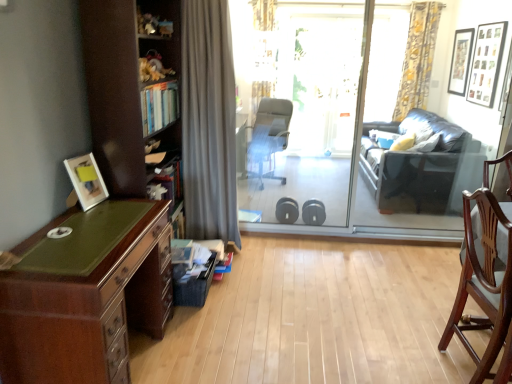
Question: Considering the positions of black matte picture frame at upper right, the 1th picture frame in the top-to-bottom sequence, and gray fabric office chair at center, marked as the first chair in a top-to-bottom arrangement, in the image, is black matte picture frame at upper right, the 1th picture frame in the top-to-bottom sequence, wider or thinner than gray fabric office chair at center, marked as the first chair in a top-to-bottom arrangement,?

Choices:
 (A) thin
 (B) wide

Answer: (A)

Question: Is point (467, 54) closer or farther from the camera than point (268, 107)?

Choices:
 (A) closer
 (B) farther

Answer: (A)

Question: Which object is the closest to the dark blue leather couch at right?

Choices:
 (A) wooden picture frame at upper right, placed as the second picture frame when sorted from back to front
 (B) mahogany wood chair at right, the 2th chair when ordered from left to right
 (C) transparent glass screen door at center
 (D) wooden bookshelf at left
 (E) transparent glass door at center

Answer: (E)

Question: Considering the real-world distances, which object is closest to the wooden bookshelf at left?

Choices:
 (A) wooden picture frame at upper right, acting as the second picture frame starting from the top
 (B) mahogany wood desk at left
 (C) transparent glass door at center
 (D) transparent glass screen door at center
 (E) mahogany wood chair at right, the first chair viewed from the front

Answer: (B)